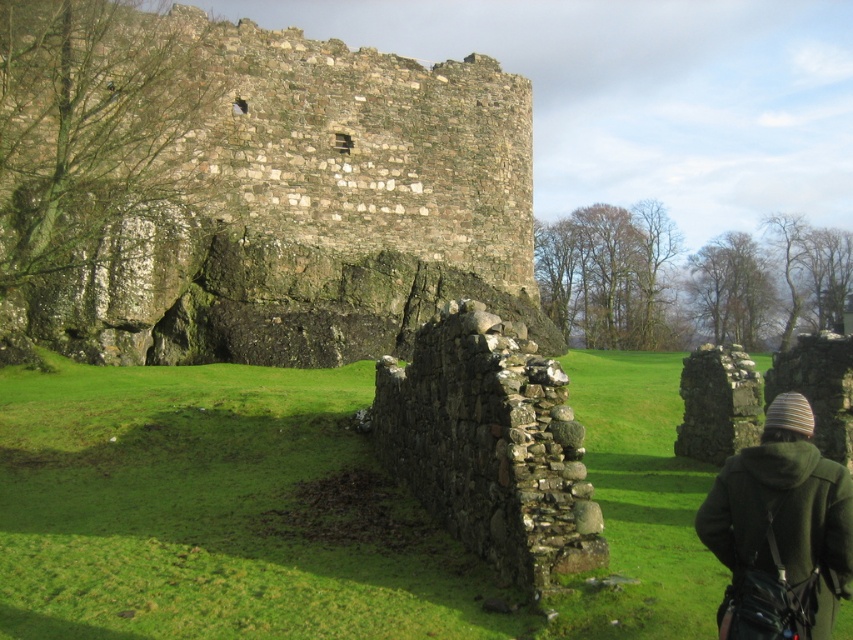
Question: Can you confirm if rustic stone wall at upper left is positioned to the left of striped woolen hat at lower right?

Choices:
 (A) no
 (B) yes

Answer: (B)

Question: Among these objects, which one is farthest from the camera?

Choices:
 (A) striped woolen hat at lower right
 (B) rustic stone wall at upper left

Answer: (B)

Question: Is the position of rustic stone wall at upper left less distant than that of striped woolen hat at lower right?

Choices:
 (A) no
 (B) yes

Answer: (A)

Question: Which point appears closest to the camera in this image?

Choices:
 (A) (786, 573)
 (B) (9, 35)

Answer: (A)

Question: Is rustic stone wall at upper left smaller than striped woolen hat at lower right?

Choices:
 (A) no
 (B) yes

Answer: (A)